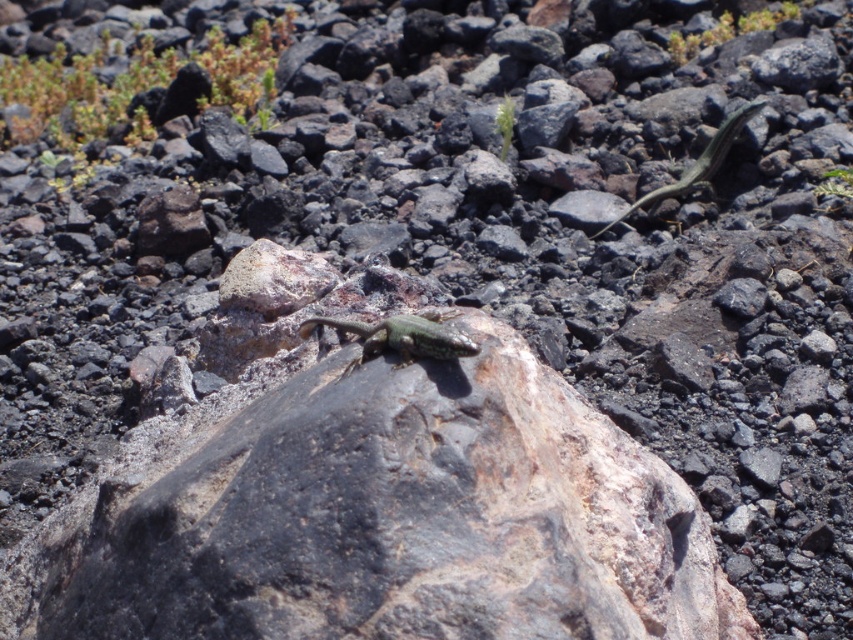
You are a wildlife photographer aiming to capture both the green scaly lizard at center and the green glossy lizard at upper right in a single shot. Given their sizes, which lizard will appear larger in your photo?

The green glossy lizard at upper right will appear larger in the photo because it is bigger than the green scaly lizard at center.

You are an observer standing in front of the rocky terrain. You see a green scaly lizard at center and a green glossy lizard at upper right. Which lizard is closer to you?

The green scaly lizard at center is closer to you because it is in front of the green glossy lizard at upper right.

You are an observer looking at the rocky terrain. You see the green scaly lizard at center and the green glossy lizard at upper right. Which lizard is positioned closer to the left side of the scene?

The green scaly lizard at center is positioned to the left of the green glossy lizard at upper right, so it is closer to the left side of the scene.